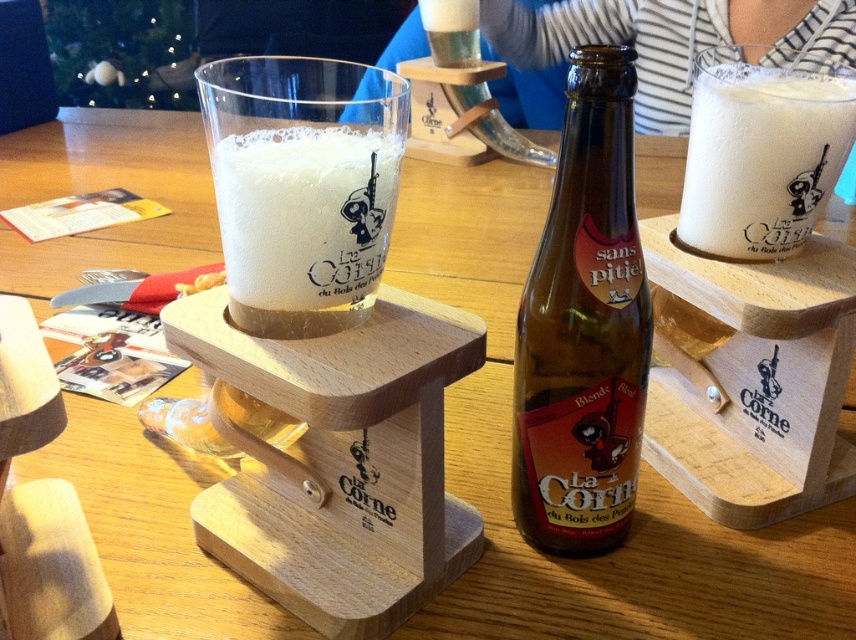
You are a customer sitting at the table in the image. You see two points marked on the table surface. One is at point coordinates point (x=551, y=291) and the other is at point coordinates point (x=818, y=93). Which point is closer to you?

The point at coordinates point (x=551, y=291) is closer to you than the point at coordinates point (x=818, y=93).

Based on the photo, you are a bartender trying to place a coaster between the brown glass bottle at center and the white frothy foam at upper right. Considering their widths, which object should you place closer to the edge of the table to ensure the coaster fits?

The brown glass bottle at center has a lesser width compared to white frothy foam at upper right, so you should place the brown glass bottle at center closer to the edge of the table to accommodate the wider white frothy foam at upper right and ensure the coaster fits between them.